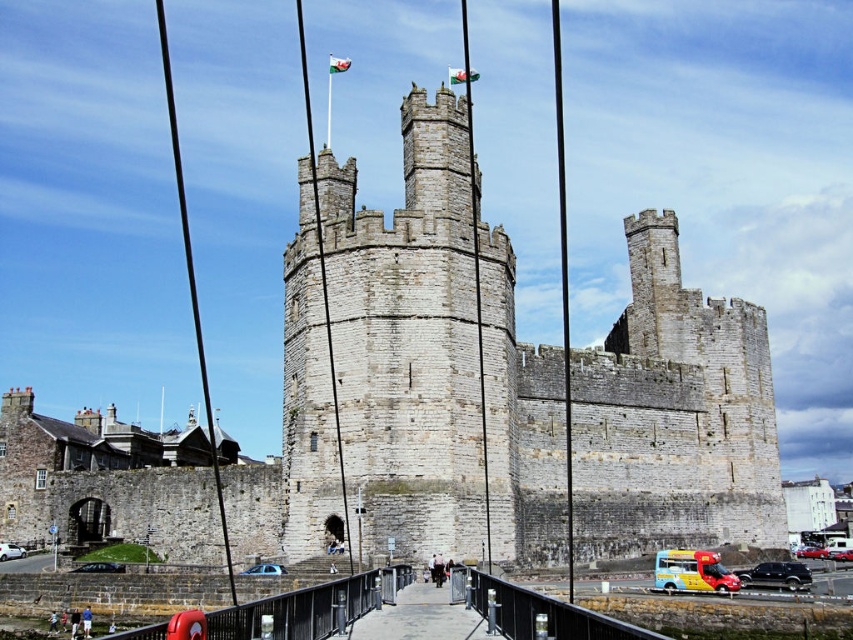
Question: Is gray stone castle at center below concrete walkway at center?

Choices:
 (A) yes
 (B) no

Answer: (B)

Question: Can you confirm if gray stone castle at center is thinner than concrete walkway at center?

Choices:
 (A) no
 (B) yes

Answer: (A)

Question: Which of these objects is positioned closest to the concrete walkway at center?

Choices:
 (A) gray stone castle at center
 (B) metallic gray bridge at center

Answer: (B)

Question: Which point is closer to the camera?

Choices:
 (A) gray stone castle at center
 (B) metallic gray bridge at center
 (C) concrete walkway at center

Answer: (B)

Question: Among these points, which one is farthest from the camera?

Choices:
 (A) (463, 634)
 (B) (280, 508)
 (C) (245, 628)

Answer: (B)

Question: Considering the relative positions of gray stone castle at center and concrete walkway at center in the image provided, where is gray stone castle at center located with respect to concrete walkway at center?

Choices:
 (A) right
 (B) left

Answer: (B)